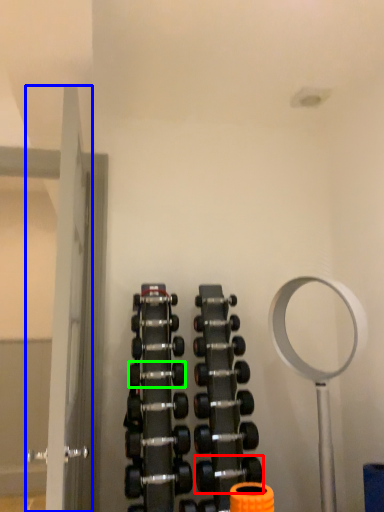
Question: Estimate the real-world distances between objects in this image. Which object is farther from dumbbell (highlighted by a red box), door (highlighted by a blue box) or dumbbell (highlighted by a green box)?

Choices:
 (A) door
 (B) dumbbell

Answer: (A)